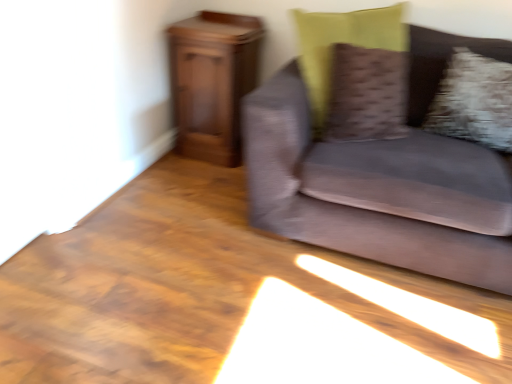
Where is `free space in front of wooden cabinet at left`? The image size is (512, 384). free space in front of wooden cabinet at left is located at coordinates (191, 183).